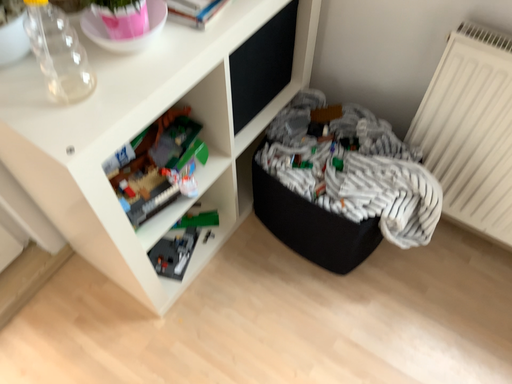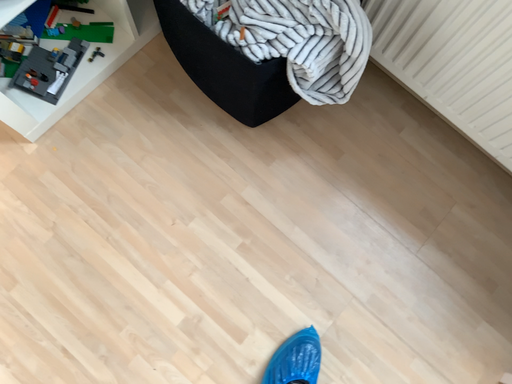
Question: Which way did the camera rotate in the video?

Choices:
 (A) rotated downward
 (B) rotated upward

Answer: (A)